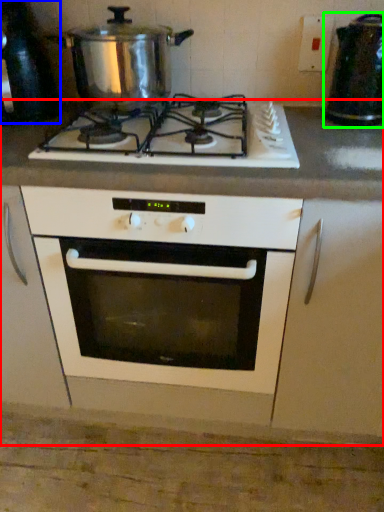
Question: Which object is positioned closest to counter (highlighted by a red box)? Select from appliance (highlighted by a blue box) and appliance (highlighted by a green box).

Choices:
 (A) appliance
 (B) appliance

Answer: (B)